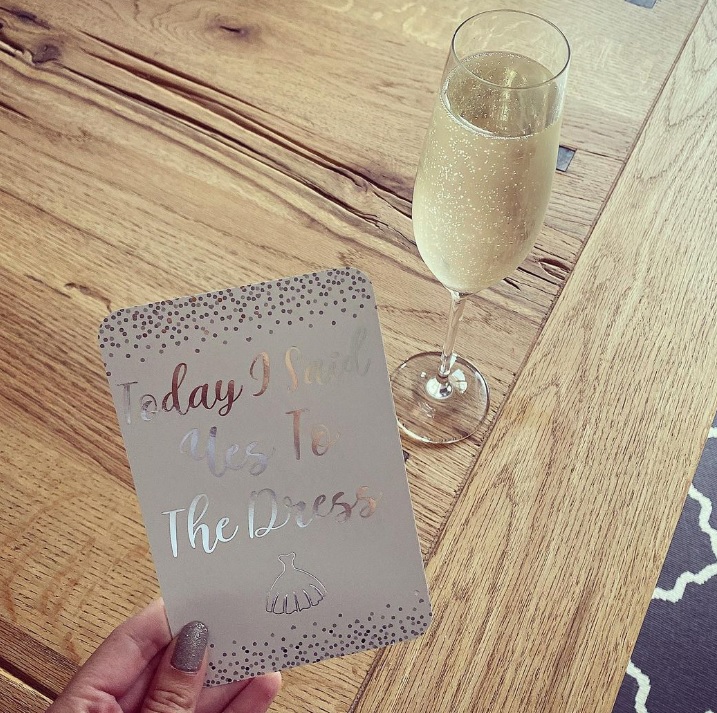
Identify the location of carpet. Image resolution: width=717 pixels, height=713 pixels. (680, 610).